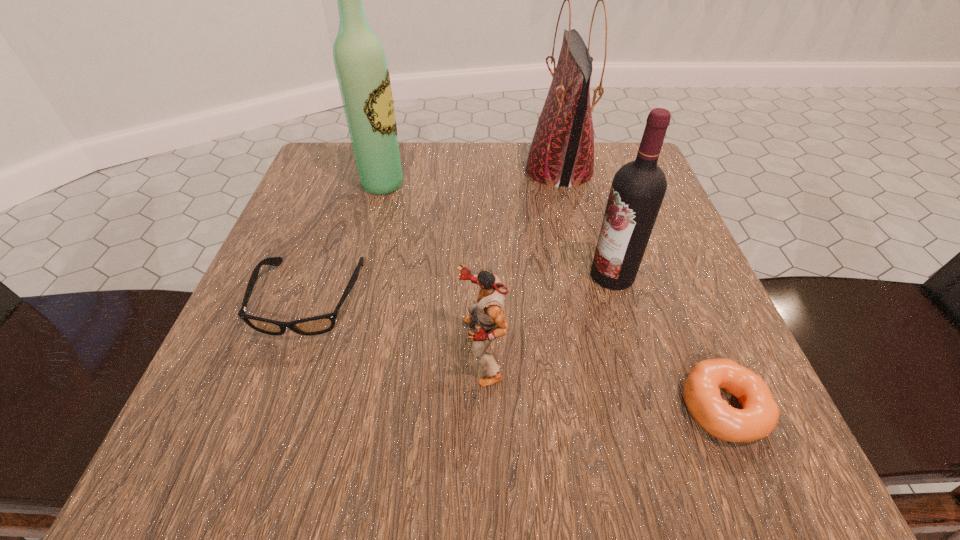
Image resolution: width=960 pixels, height=540 pixels. I want to click on handbag that is at the far edge, so click(562, 151).

This screenshot has width=960, height=540. What are the coordinates of `object that is at the near edge` in the screenshot? It's located at 758,417.

Where is `wine bottle located in the left edge section of the desktop`? wine bottle located in the left edge section of the desktop is located at coordinates (362, 72).

The height and width of the screenshot is (540, 960). In order to click on spectacles positioned at the left edge in this screenshot , I will do `click(317, 325)`.

The width and height of the screenshot is (960, 540). Identify the location of handbag that is positioned at the right edge. (562, 151).

You are a GUI agent. You are given a task and a screenshot of the screen. Output one action in this format:
    pyautogui.click(x=<x>, y=<y>)
    Task: Click on the wine bottle that is at the right edge
    
    Given the screenshot: What is the action you would take?
    pyautogui.click(x=638, y=188)

Where is `doughnut that is at the right edge`? The width and height of the screenshot is (960, 540). doughnut that is at the right edge is located at coordinates (758, 417).

I want to click on object present at the far left corner, so click(362, 72).

Find the location of `object that is positioned at the far right corner`. object that is positioned at the far right corner is located at coordinates (562, 151).

The height and width of the screenshot is (540, 960). What are the coordinates of `object at the near right corner` in the screenshot? It's located at pyautogui.click(x=758, y=417).